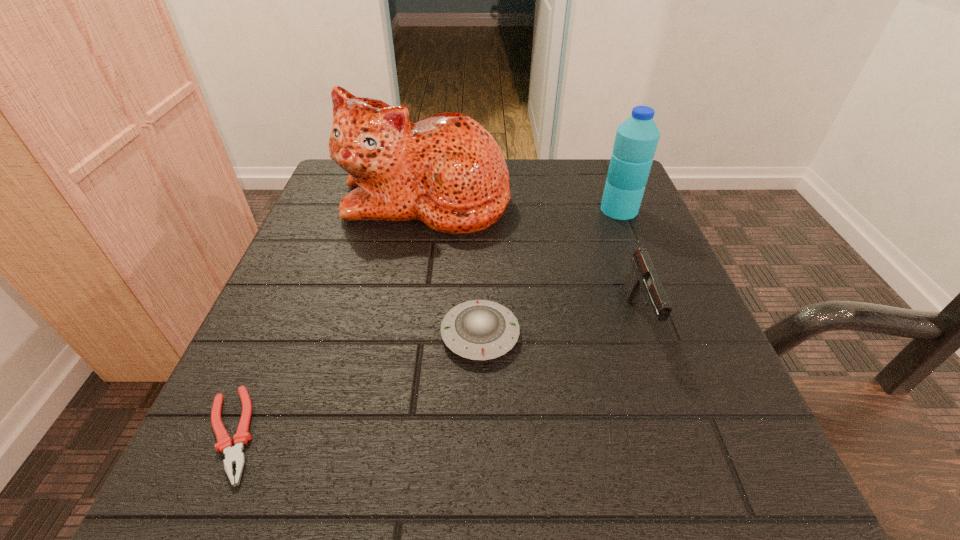
The height and width of the screenshot is (540, 960). In order to click on object positioned at the far right corner in this screenshot , I will do `click(636, 140)`.

I want to click on free space at the near edge of the desktop, so click(584, 504).

You are a GUI agent. You are given a task and a screenshot of the screen. Output one action in this format:
    pyautogui.click(x=<x>, y=<y>)
    Task: Click on the free space at the left edge
    The image size is (960, 540).
    Given the screenshot: What is the action you would take?
    pyautogui.click(x=363, y=265)

In the image, there is a desktop. Identify the location of vacant space at the far left corner. This screenshot has height=540, width=960. (331, 205).

The height and width of the screenshot is (540, 960). In the image, there is a desktop. In order to click on free space at the far right corner in this screenshot , I will do `click(572, 188)`.

At what (x,y) coordinates should I click in order to perform the action: click on free space at the near right corner of the desktop. Please return your answer as a coordinate pair (x, y). This screenshot has width=960, height=540. Looking at the image, I should click on click(765, 512).

The image size is (960, 540). Find the location of `free spot between the fourth tallest object and the water bottle`. free spot between the fourth tallest object and the water bottle is located at coordinates (550, 272).

Locate an element on the screen. Image resolution: width=960 pixels, height=540 pixels. blank region between the cat and the saucer is located at coordinates (453, 267).

Identify the location of unoccupied area between the nearest object and the saucer. (355, 384).

Where is `vacant space that is in between the pistol and the water bottle`? vacant space that is in between the pistol and the water bottle is located at coordinates (629, 264).